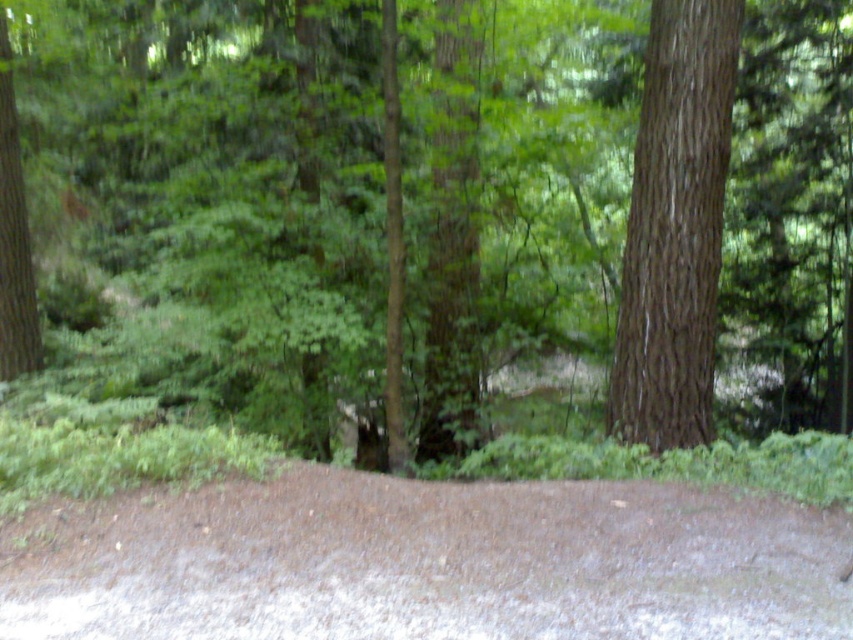
Between green leafy forest at center and brown rough bark tree at right, which one is positioned lower?

brown rough bark tree at right is below.

Can you confirm if green leafy forest at center is smaller than brown rough bark tree at right?

No, green leafy forest at center is not smaller than brown rough bark tree at right.

Which is behind, point (263, 396) or point (676, 435)?

The point (263, 396) is more distant.

The image size is (853, 640). What are the coordinates of `green leafy forest at center` in the screenshot? It's located at (616, 220).

What do you see at coordinates (616, 220) in the screenshot?
I see `green leafy forest at center` at bounding box center [616, 220].

Locate an element on the screen. This screenshot has width=853, height=640. green leafy forest at center is located at coordinates (616, 220).

Locate an element on the screen. The height and width of the screenshot is (640, 853). brown dirt path at lower center is located at coordinates (436, 564).

Can you confirm if brown dirt path at lower center is positioned above brown rough bark tree at right?

No.

Describe the element at coordinates (436, 564) in the screenshot. I see `brown dirt path at lower center` at that location.

I want to click on brown dirt path at lower center, so pyautogui.click(x=436, y=564).